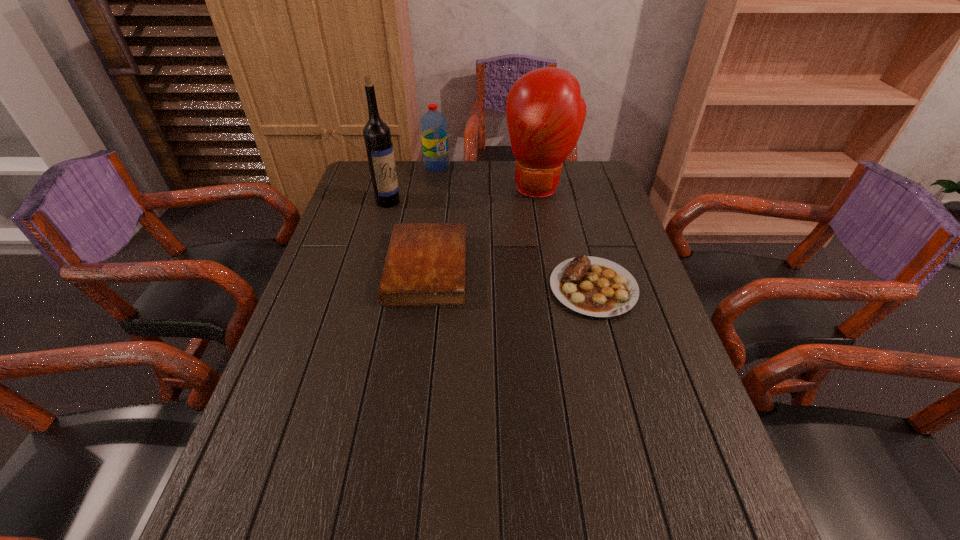
Image resolution: width=960 pixels, height=540 pixels. In order to click on vacant space situated 0.100m on the label of the wine bottle in this screenshot , I will do `click(413, 220)`.

At what (x,y) coordinates should I click in order to perform the action: click on vacant area situated on the label of the wine bottle. Please return your answer as a coordinate pair (x, y). Image resolution: width=960 pixels, height=540 pixels. Looking at the image, I should click on (454, 250).

Identify the location of vacant space situated 0.070m on the striking surface of the boxing glove. The image size is (960, 540). (537, 218).

The image size is (960, 540). I want to click on vacant position located on the striking surface of the boxing glove, so click(535, 244).

Locate an element on the screen. free space located on the striking surface of the boxing glove is located at coordinates (536, 231).

In order to click on free location located 0.060m on the front label of the water bottle in this screenshot , I will do `click(446, 180)`.

Identify the location of free space located 0.140m on the front label of the water bottle. (455, 191).

Find the location of a particular element. This screenshot has height=540, width=960. vacant space located on the front label of the water bottle is located at coordinates (466, 205).

Image resolution: width=960 pixels, height=540 pixels. In order to click on wine bottle that is at the far edge in this screenshot , I will do `click(379, 147)`.

Identify the location of boxing glove present at the far edge. The image size is (960, 540). (545, 113).